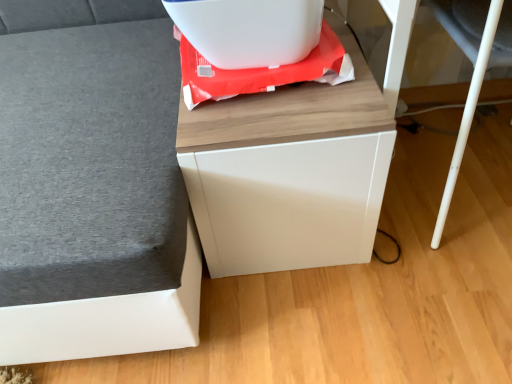
The height and width of the screenshot is (384, 512). Find the location of `free point in front of white plastic swivel chair at lower right`. free point in front of white plastic swivel chair at lower right is located at coordinates (444, 305).